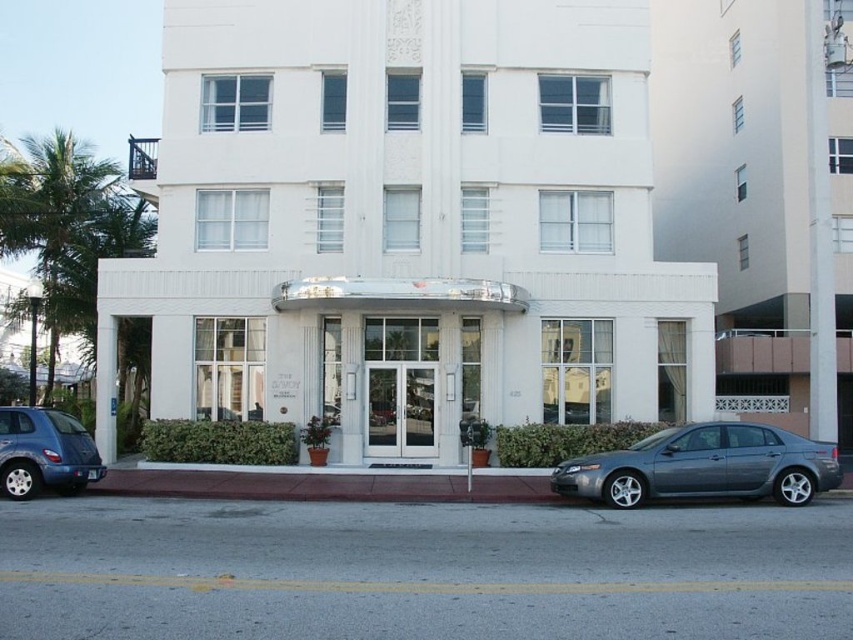
Question: Which point is closer to the camera taking this photo?

Choices:
 (A) (265, 484)
 (B) (706, 234)
 (C) (650, 445)

Answer: (C)

Question: From the image, what is the correct spatial relationship of white smooth building at right in relation to metallic gray sedan at lower right?

Choices:
 (A) left
 (B) right

Answer: (B)

Question: Which of these objects is positioned closest to the metallic gray sedan at lower right?

Choices:
 (A) white smooth building at right
 (B) matte blue suv at lower left
 (C) white smooth building at center

Answer: (C)

Question: Considering the relative positions of white smooth building at center and metallic gray sedan at lower right in the image provided, where is white smooth building at center located with respect to metallic gray sedan at lower right?

Choices:
 (A) right
 (B) left

Answer: (B)

Question: Can you confirm if white smooth building at right is thinner than metallic gray sedan at lower right?

Choices:
 (A) no
 (B) yes

Answer: (A)

Question: Which is nearer to the white smooth building at center?

Choices:
 (A) matte blue suv at lower left
 (B) white smooth building at right

Answer: (B)